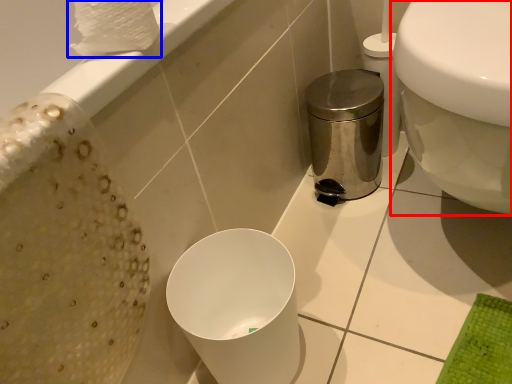
Question: Which object appears closest to the camera in this image, toilet (highlighted by a red box) or toilet paper (highlighted by a blue box)?

Choices:
 (A) toilet
 (B) toilet paper

Answer: (A)